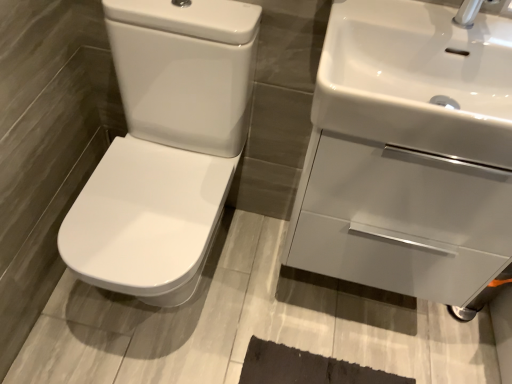
Identify the location of vacant space underneath white glossy toilet at left (from a real-world perspective). Image resolution: width=512 pixels, height=384 pixels. (165, 299).